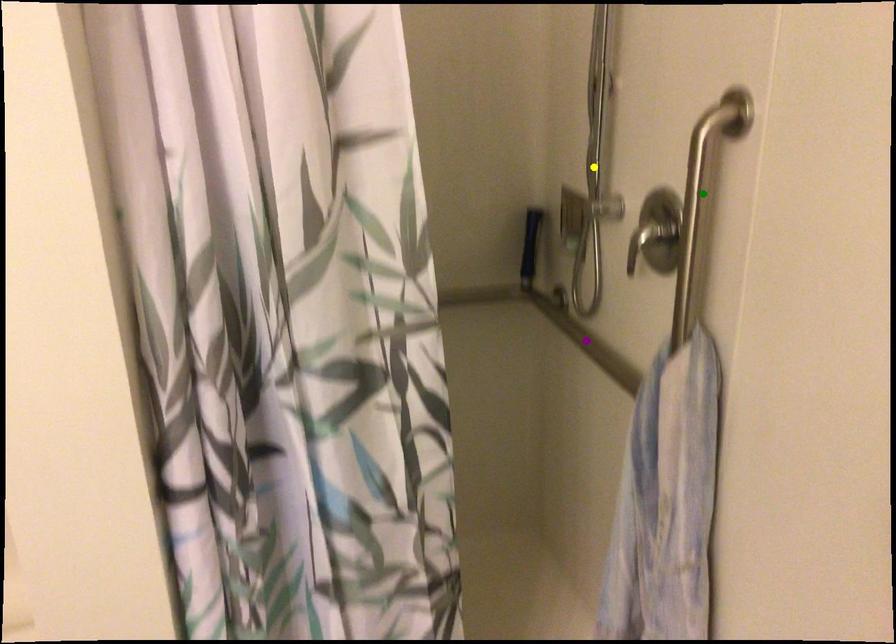
Order these from nearest to farthest:
A) yellow point
B) green point
C) purple point

1. green point
2. purple point
3. yellow point